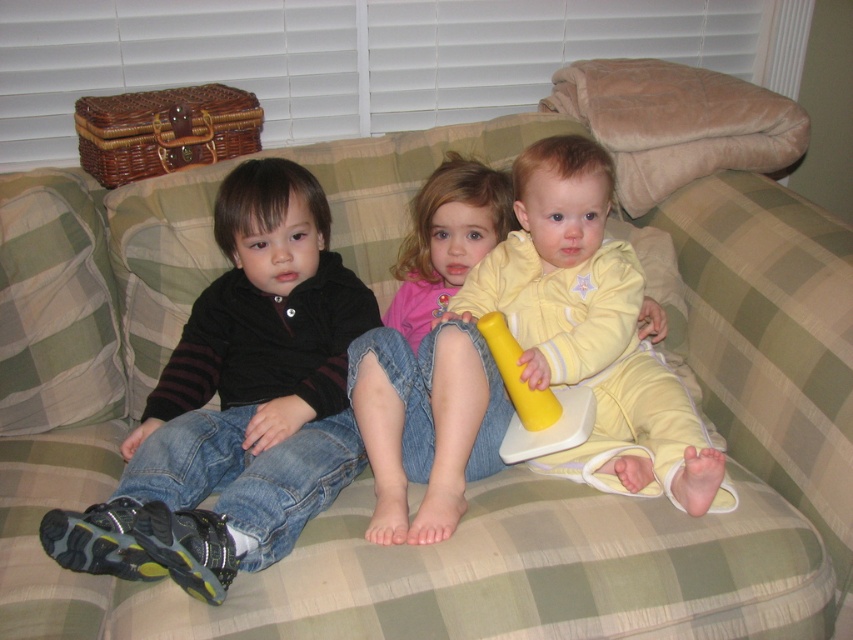
Consider the image. Between matte black shirt at left and pink fabric pants at center, which one has more height?

Standing taller between the two is matte black shirt at left.

Does matte black shirt at left have a lesser height compared to pink fabric pants at center?

In fact, matte black shirt at left may be taller than pink fabric pants at center.

Which is in front, point (355, 332) or point (416, 518)?

Point (416, 518)

Where is `matte black shirt at left`? matte black shirt at left is located at coordinates (238, 403).

Is matte black shirt at left positioned in front of pink fabric shirt at center?

Yes, it is in front of pink fabric shirt at center.

Between matte black shirt at left and pink fabric shirt at center, which one has more height?

matte black shirt at left

Image resolution: width=853 pixels, height=640 pixels. Find the location of `matte black shirt at left`. matte black shirt at left is located at coordinates (238, 403).

Where is `matte black shirt at left`? Image resolution: width=853 pixels, height=640 pixels. matte black shirt at left is located at coordinates (238, 403).

Find the location of a particular element. Image resolution: width=853 pixels, height=640 pixels. yellow rubber hammer at center is located at coordinates (592, 330).

Image resolution: width=853 pixels, height=640 pixels. Describe the element at coordinates (592, 330) in the screenshot. I see `yellow rubber hammer at center` at that location.

Find the location of a particular element. yellow rubber hammer at center is located at coordinates (592, 330).